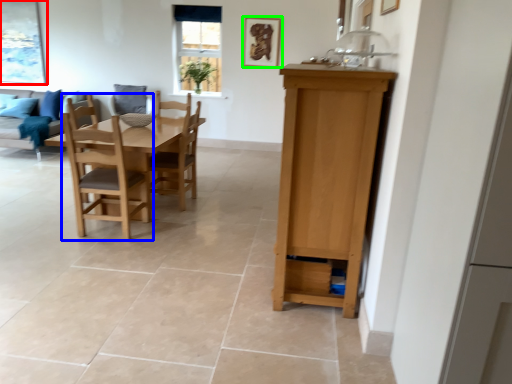
Question: Which is nearer to the picture frame (highlighted by a red box)? chair (highlighted by a blue box) or picture frame (highlighted by a green box).

Choices:
 (A) chair
 (B) picture frame

Answer: (B)